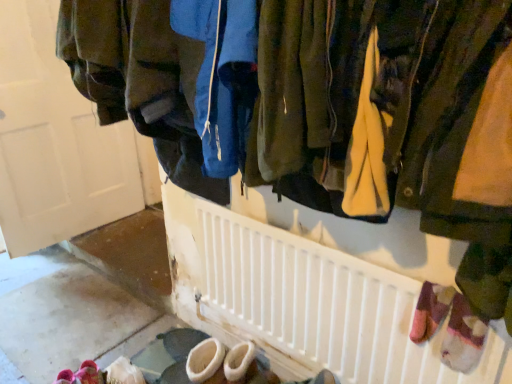
Question: Would you say matte white door at upper left is a long distance from pink fuzzy slippers at lower left?

Choices:
 (A) no
 (B) yes

Answer: (B)

Question: Is matte white door at upper left outside pink fuzzy slippers at lower left?

Choices:
 (A) no
 (B) yes

Answer: (B)

Question: Does matte white door at upper left appear on the right side of pink fuzzy slippers at lower left?

Choices:
 (A) no
 (B) yes

Answer: (A)

Question: From a real-world perspective, is matte white door at upper left positioned over pink fuzzy slippers at lower left based on gravity?

Choices:
 (A) no
 (B) yes

Answer: (B)

Question: Is matte white door at upper left to the left of pink fuzzy slippers at lower left from the viewer's perspective?

Choices:
 (A) yes
 (B) no

Answer: (A)

Question: Looking at their shapes, would you say pink fuzzy slippers at lower left is wider or thinner than white plastic radiator at center?

Choices:
 (A) thin
 (B) wide

Answer: (B)

Question: From the image's perspective, is pink fuzzy slippers at lower left positioned above or below white plastic radiator at center?

Choices:
 (A) above
 (B) below

Answer: (B)

Question: In the image, is pink fuzzy slippers at lower left positioned in front of or behind white plastic radiator at center?

Choices:
 (A) front
 (B) behind

Answer: (B)

Question: Is point (101, 380) positioned closer to the camera than point (392, 258)?

Choices:
 (A) farther
 (B) closer

Answer: (A)

Question: Looking at their shapes, would you say matte white door at upper left is wider or thinner than pink fuzzy slippers at lower left?

Choices:
 (A) wide
 (B) thin

Answer: (B)

Question: Is point (11, 210) positioned closer to the camera than point (95, 370)?

Choices:
 (A) closer
 (B) farther

Answer: (B)

Question: Based on their sizes in the image, would you say matte white door at upper left is bigger or smaller than pink fuzzy slippers at lower left?

Choices:
 (A) big
 (B) small

Answer: (A)

Question: Would you say matte white door at upper left is inside or outside pink fuzzy slippers at lower left?

Choices:
 (A) inside
 (B) outside

Answer: (B)

Question: Is matte white door at upper left taller or shorter than white plastic radiator at center?

Choices:
 (A) tall
 (B) short

Answer: (A)

Question: Based on their sizes in the image, would you say matte white door at upper left is bigger or smaller than white plastic radiator at center?

Choices:
 (A) small
 (B) big

Answer: (B)